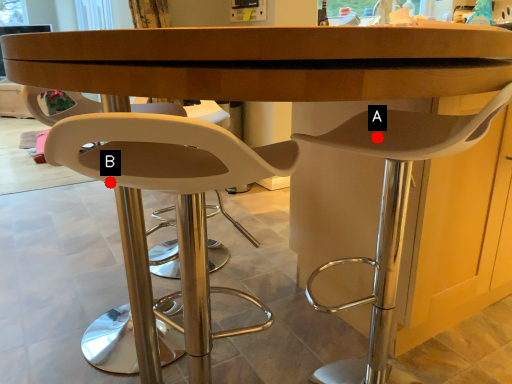
Question: Two points are circled on the image, labeled by A and B beside each circle. Which point is farther from the camera taking this photo?

Choices:
 (A) A is further
 (B) B is further

Answer: (A)